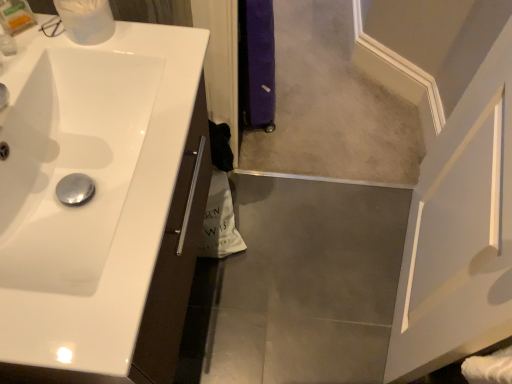
Question: Should I look upward or downward to see beige carpet at center?

Choices:
 (A) up
 (B) down

Answer: (A)

Question: Can you confirm if translucent plastic container at upper left is wider than beige carpet at center?

Choices:
 (A) no
 (B) yes

Answer: (A)

Question: Can you confirm if translucent plastic container at upper left is positioned to the left of beige carpet at center?

Choices:
 (A) no
 (B) yes

Answer: (B)

Question: Would you say translucent plastic container at upper left is outside beige carpet at center?

Choices:
 (A) no
 (B) yes

Answer: (B)

Question: Is translucent plastic container at upper left further to camera compared to beige carpet at center?

Choices:
 (A) yes
 (B) no

Answer: (B)

Question: Can beige carpet at center be found inside translucent plastic container at upper left?

Choices:
 (A) no
 (B) yes

Answer: (A)

Question: Considering the relative sizes of translucent plastic container at upper left and beige carpet at center in the image provided, is translucent plastic container at upper left shorter than beige carpet at center?

Choices:
 (A) yes
 (B) no

Answer: (B)

Question: Does beige carpet at center have a lesser width compared to white glossy sink at left?

Choices:
 (A) yes
 (B) no

Answer: (B)

Question: Is beige carpet at center positioned with its back to white glossy sink at left?

Choices:
 (A) yes
 (B) no

Answer: (B)

Question: From a real-world perspective, does beige carpet at center stand above white glossy sink at left?

Choices:
 (A) yes
 (B) no

Answer: (B)

Question: Is the position of beige carpet at center less distant than that of white glossy sink at left?

Choices:
 (A) no
 (B) yes

Answer: (A)

Question: Does beige carpet at center lie behind white glossy sink at left?

Choices:
 (A) yes
 (B) no

Answer: (A)

Question: Is beige carpet at center far from white glossy sink at left?

Choices:
 (A) no
 (B) yes

Answer: (B)

Question: Considering the relative sizes of white glossy sink at left and translucent plastic container at upper left in the image provided, is white glossy sink at left smaller than translucent plastic container at upper left?

Choices:
 (A) no
 (B) yes

Answer: (A)